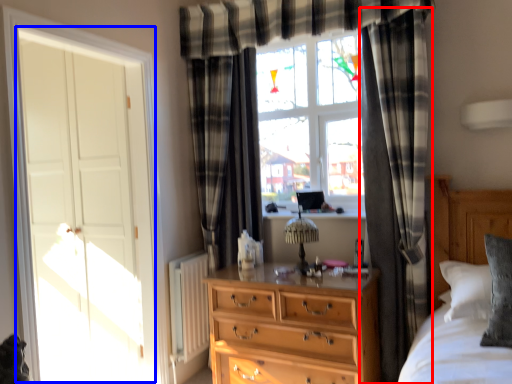
Question: Which point is further to the camera, curtain (highlighted by a red box) or screen door (highlighted by a blue box)?

Choices:
 (A) curtain
 (B) screen door

Answer: (A)